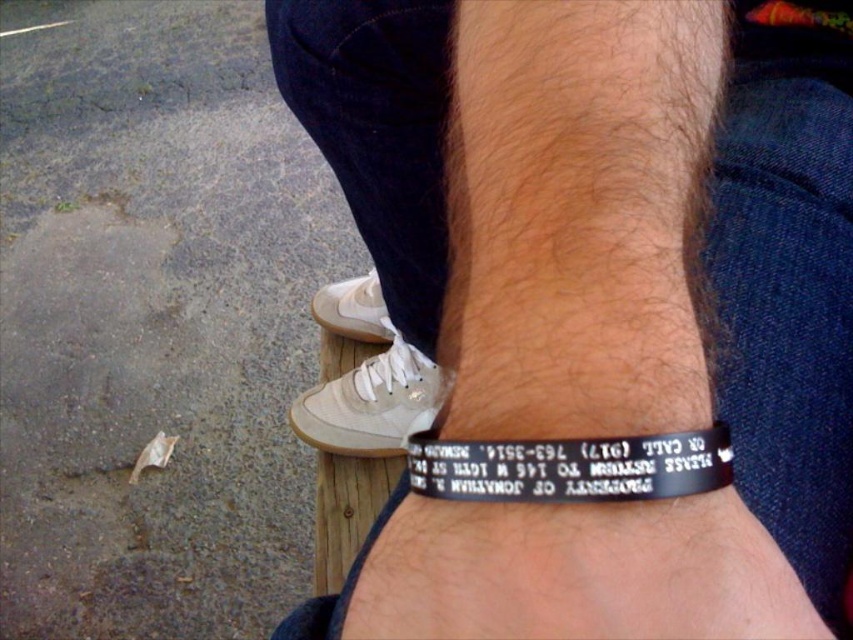
You are a delivery person who needs to place a small package between the black rubber bracelet at center and the black rubber bracelet at lower center. The package is 10 inches long. Can you fit it between them?

The distance between the black rubber bracelet at center and the black rubber bracelet at lower center is 8.99 inches. Since the package is 10 inches long, it cannot fit between them as the space is smaller than the package.

You are a photographer trying to capture a close detail shot of the black rubber bracelet at center and the black rubber bracelet at lower center. Since you want both bracelets to be clearly visible in the photo, which bracelet should you focus on first to ensure proper depth of field?

The black rubber bracelet at lower center should be focused on first because it is closer to the camera than the black rubber bracelet at center, which is above it. This way, both bracelets will be in focus due to the depth of field.

In the scene shown: You are a photographer trying to capture the black rubber bracelet at center and the black rubber bracelet at lower center in a clear shot. Which bracelet should you focus on to ensure it appears larger in the photo?

The black rubber bracelet at center has a greater height compared to the black rubber bracelet at lower center, so focusing on it will make it appear larger in the photo.